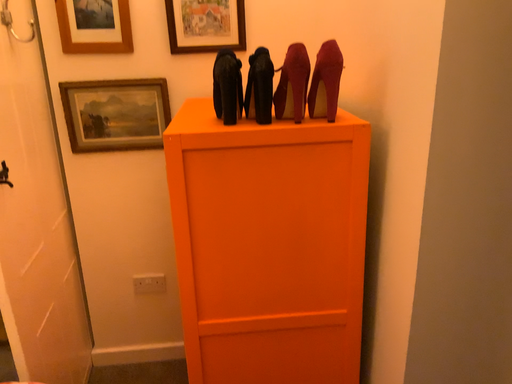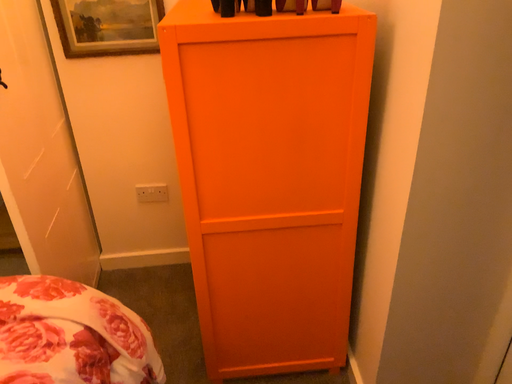
Question: How did the camera likely rotate when shooting the video?

Choices:
 (A) rotated downward
 (B) rotated upward

Answer: (A)